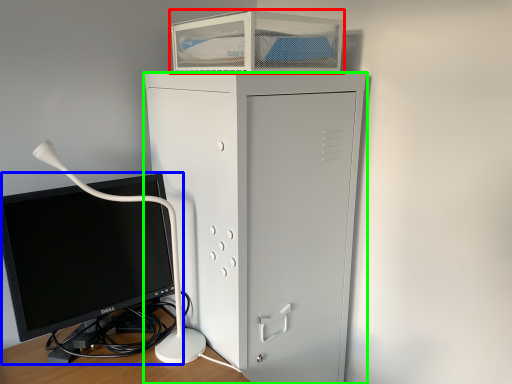
Question: Based on their relative distances, which object is nearer to desktop (highlighted by a red box)? Choose from computer monitor (highlighted by a blue box) and furniture (highlighted by a green box).

Choices:
 (A) computer monitor
 (B) furniture

Answer: (B)